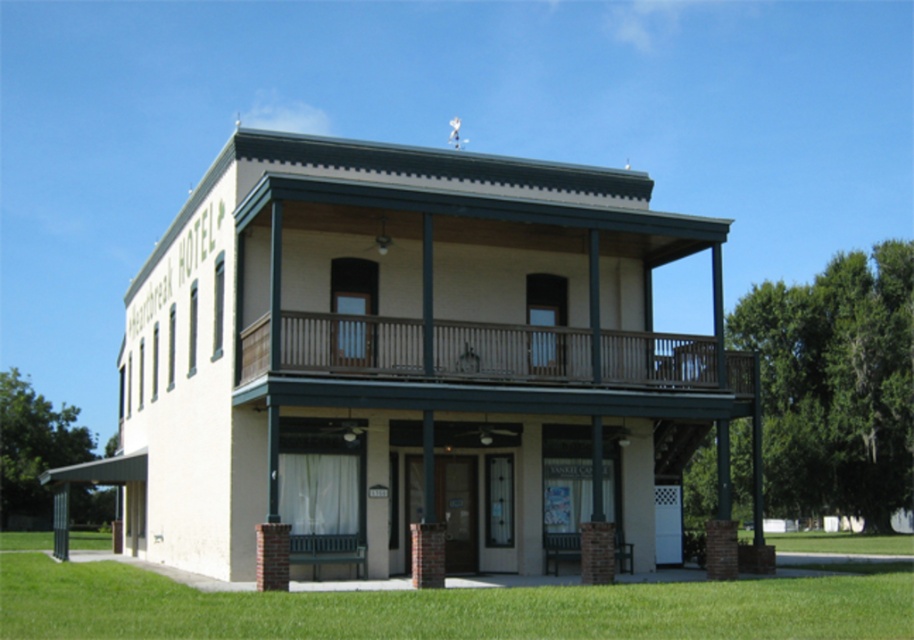
Question: Does green grass at lower center have a greater width compared to brown wooden porch at upper center?

Choices:
 (A) yes
 (B) no

Answer: (A)

Question: Which point is closer to the camera taking this photo?

Choices:
 (A) (293, 397)
 (B) (851, 632)

Answer: (B)

Question: Can you confirm if green grass at lower center is positioned below brown wooden porch at upper center?

Choices:
 (A) yes
 (B) no

Answer: (A)

Question: Among these objects, which one is farthest from the camera?

Choices:
 (A) brown wooden porch at upper center
 (B) green grass at lower center

Answer: (A)

Question: Can you confirm if green grass at lower center is smaller than brown wooden porch at upper center?

Choices:
 (A) no
 (B) yes

Answer: (A)